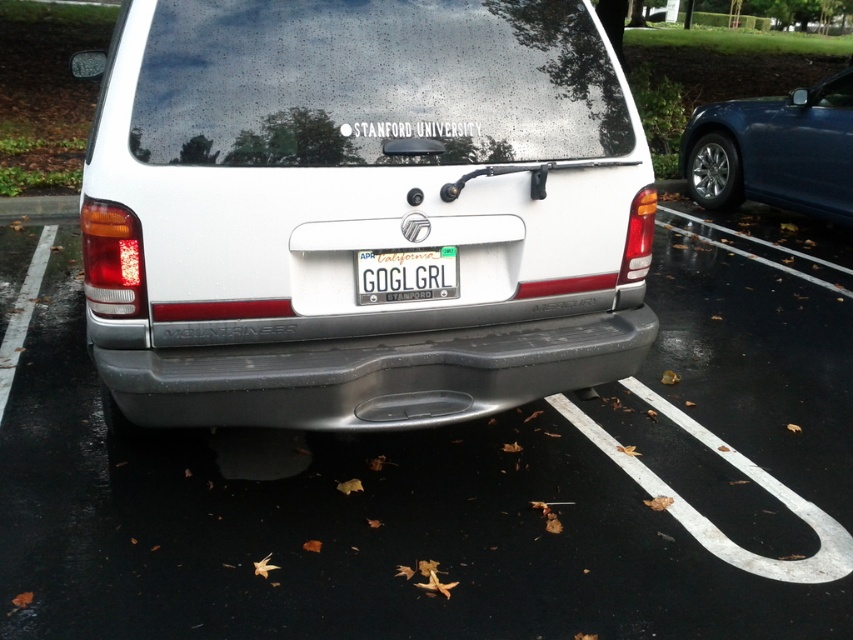
You are a parking attendant who needs to fit a compact car into the parking space. The space is currently occupied by the white matte van at center and the glossy blue sedan at right. Which vehicle should you ask the owner to move to make room for the compact car?

The white matte van at center occupies less space than the glossy blue sedan at right, so you should ask the owner of the glossy blue sedan at right to move it to free up more space for the compact car.

You are a delivery driver needing to park your van behind the white Mercury Mountaineer. The van requires a minimum of 5 meters of space to park safely. Can you park your van behind the gray matte bumper at center without hitting the glossy blue sedan at right?

The distance between the gray matte bumper at center and the glossy blue sedan at right is 4.87 meters, which is less than the required 5 meters. Therefore, you cannot safely park your van there without risking a collision.

Based on the photo, you are a delivery driver who needs to park your white matte van at center in a parking spot that is 8 feet wide. Can your van fit into the spot without touching the neighboring vehicles?

The white matte van at center is 7.32 feet apart from the neighboring vehicles, which is less than the 8 feet width of the parking spot. Therefore, the van can fit into the spot without touching the neighboring vehicles.